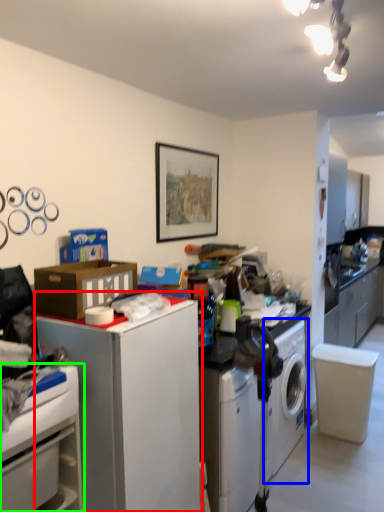
Question: Considering the real-world distances, which object is closest to file cabinet (highlighted by a red box)? washing machine (highlighted by a blue box) or cabinetry (highlighted by a green box).

Choices:
 (A) washing machine
 (B) cabinetry

Answer: (B)